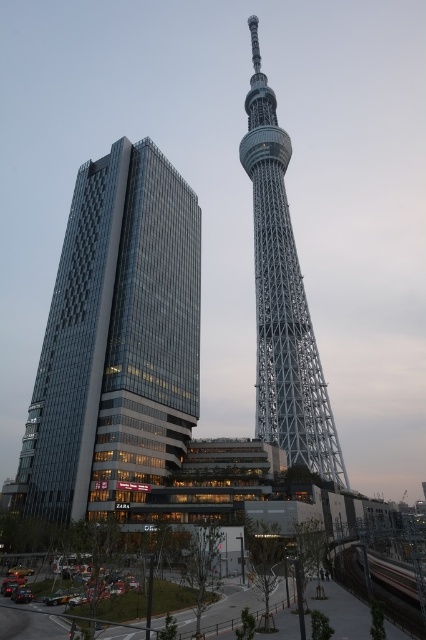
Question: Is glassy modern building at left to the left of silver metallic eiffel tower at center from the viewer's perspective?

Choices:
 (A) yes
 (B) no

Answer: (A)

Question: In this image, where is glassy modern building at left located relative to silver metallic eiffel tower at center?

Choices:
 (A) right
 (B) left

Answer: (B)

Question: Which point is closer to the camera?

Choices:
 (A) (189, 195)
 (B) (290, 413)

Answer: (B)

Question: Is glassy modern building at left closer to the viewer compared to silver metallic eiffel tower at center?

Choices:
 (A) yes
 (B) no

Answer: (A)

Question: Which of the following is the closest to the observer?

Choices:
 (A) (118, 289)
 (B) (331, 448)

Answer: (A)

Question: Which of the following is the farthest from the observer?

Choices:
 (A) (158, 225)
 (B) (331, 458)

Answer: (B)